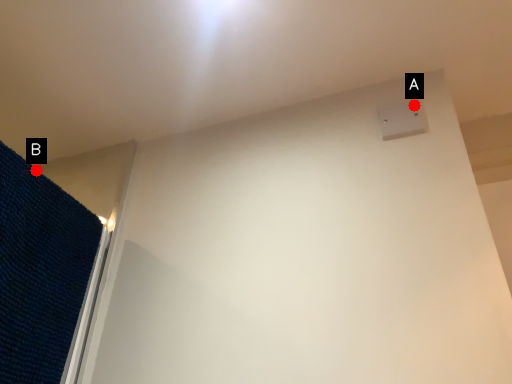
Question: Two points are circled on the image, labeled by A and B beside each circle. Which of the following is the closest to the observer?

Choices:
 (A) A is closer
 (B) B is closer

Answer: (B)